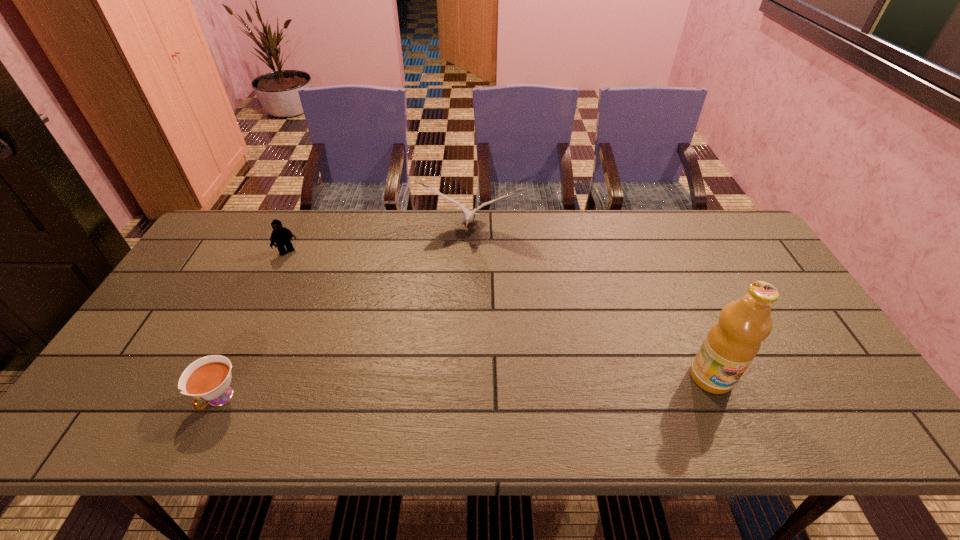
The height and width of the screenshot is (540, 960). In order to click on free region located 0.210m on the face of the third tallest object in this screenshot , I will do `click(323, 293)`.

Identify the location of free spot located 0.320m on the face of the third tallest object. This screenshot has height=540, width=960. (341, 315).

This screenshot has width=960, height=540. I want to click on gull that is at the far edge, so click(x=469, y=216).

I want to click on Lego positioned at the far edge, so click(x=280, y=235).

Locate an element on the screen. teacup located in the near edge section of the desktop is located at coordinates (208, 378).

Locate an element on the screen. Image resolution: width=960 pixels, height=540 pixels. olive oil located in the near edge section of the desktop is located at coordinates (731, 344).

The height and width of the screenshot is (540, 960). In order to click on vacant space at the far edge in this screenshot , I will do `click(301, 239)`.

You are a GUI agent. You are given a task and a screenshot of the screen. Output one action in this format:
    pyautogui.click(x=<x>, y=<y>)
    Task: Click on the free space at the near edge of the desktop
    The image size is (960, 540).
    Given the screenshot: What is the action you would take?
    pyautogui.click(x=461, y=386)

Where is `free space at the right edge of the desktop`? free space at the right edge of the desktop is located at coordinates (759, 257).

Identify the location of vacant space at the far left corner of the desktop. This screenshot has height=540, width=960. (221, 225).